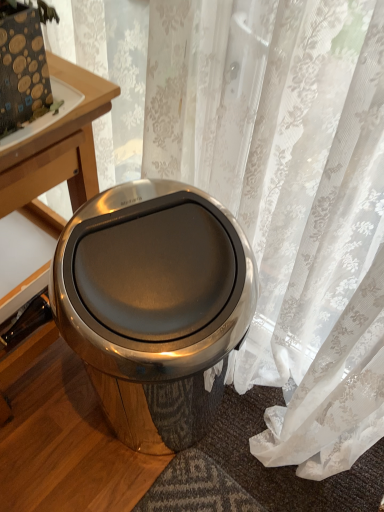
Question: Is wooden table at left wider than polished stainless steel trash can at center?

Choices:
 (A) no
 (B) yes

Answer: (B)

Question: Does wooden table at left have a smaller size compared to polished stainless steel trash can at center?

Choices:
 (A) yes
 (B) no

Answer: (B)

Question: From the image's perspective, is wooden table at left under polished stainless steel trash can at center?

Choices:
 (A) no
 (B) yes

Answer: (A)

Question: Would you say wooden table at left is a long distance from polished stainless steel trash can at center?

Choices:
 (A) no
 (B) yes

Answer: (A)

Question: Is wooden table at left thinner than polished stainless steel trash can at center?

Choices:
 (A) yes
 (B) no

Answer: (B)

Question: In terms of width, does translucent floral curtain at center look wider or thinner when compared to wooden table at left?

Choices:
 (A) wide
 (B) thin

Answer: (B)

Question: From the image's perspective, is translucent floral curtain at center positioned above or below wooden table at left?

Choices:
 (A) below
 (B) above

Answer: (B)

Question: Based on their sizes in the image, would you say translucent floral curtain at center is bigger or smaller than wooden table at left?

Choices:
 (A) small
 (B) big

Answer: (A)

Question: Considering the positions of translucent floral curtain at center and wooden table at left in the image, is translucent floral curtain at center taller or shorter than wooden table at left?

Choices:
 (A) short
 (B) tall

Answer: (B)

Question: Is wooden table at upper left bigger or smaller than wooden table at left?

Choices:
 (A) small
 (B) big

Answer: (A)

Question: Considering the positions of point (26, 159) and point (4, 214), is point (26, 159) closer or farther from the camera than point (4, 214)?

Choices:
 (A) closer
 (B) farther

Answer: (A)

Question: Considering the relative positions of wooden table at upper left and wooden table at left in the image provided, is wooden table at upper left to the left or to the right of wooden table at left?

Choices:
 (A) right
 (B) left

Answer: (A)

Question: In terms of width, does wooden table at upper left look wider or thinner when compared to wooden table at left?

Choices:
 (A) thin
 (B) wide

Answer: (A)

Question: Looking at the image, does wooden table at upper left seem bigger or smaller compared to translucent floral curtain at center?

Choices:
 (A) small
 (B) big

Answer: (A)

Question: From a real-world perspective, is wooden table at upper left positioned above or below translucent floral curtain at center?

Choices:
 (A) below
 (B) above

Answer: (B)